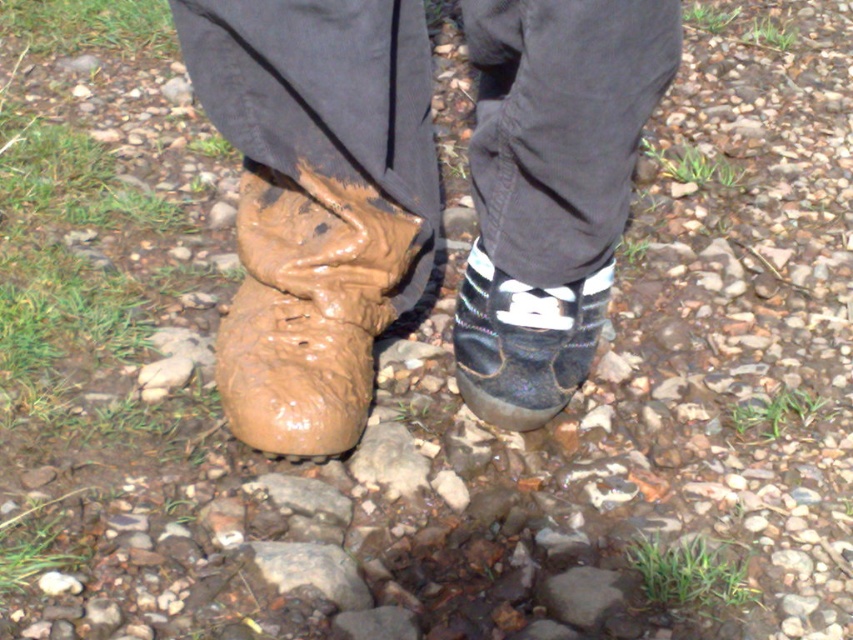
Looking at this image, is muddy rubber boot at lower left closer to the viewer compared to shiny black shoe at lower center?

That is True.

Who is more distant from viewer, (346, 353) or (486, 412)?

Positioned behind is point (486, 412).

Is point (270, 364) closer to viewer compared to point (585, 314)?

Yes, point (270, 364) is in front of point (585, 314).

At what (x,y) coordinates should I click in order to perform the action: click on muddy rubber boot at lower left. Please return your answer as a coordinate pair (x, y). The height and width of the screenshot is (640, 853). Looking at the image, I should click on (309, 308).

The height and width of the screenshot is (640, 853). I want to click on muddy rubber boot at left, so click(316, 202).

Can you confirm if muddy rubber boot at left is positioned to the left of brown rough rock at center?

No, muddy rubber boot at left is not to the left of brown rough rock at center.

Measure the distance between muddy rubber boot at left and camera.

They are 33.53 inches apart.

Locate an element on the screen. muddy rubber boot at left is located at coordinates (316, 202).

Can you confirm if muddy rubber boot at left is positioned to the right of shiny black shoe at lower center?

No, muddy rubber boot at left is not to the right of shiny black shoe at lower center.

Does muddy rubber boot at left appear under shiny black shoe at lower center?

No.

Is point (299, 74) positioned behind point (598, 291)?

No, (299, 74) is in front of (598, 291).

You are a GUI agent. You are given a task and a screenshot of the screen. Output one action in this format:
    pyautogui.click(x=<x>, y=<y>)
    Task: Click on the muddy rubber boot at left
    Image resolution: width=853 pixels, height=640 pixels.
    Given the screenshot: What is the action you would take?
    pyautogui.click(x=316, y=202)